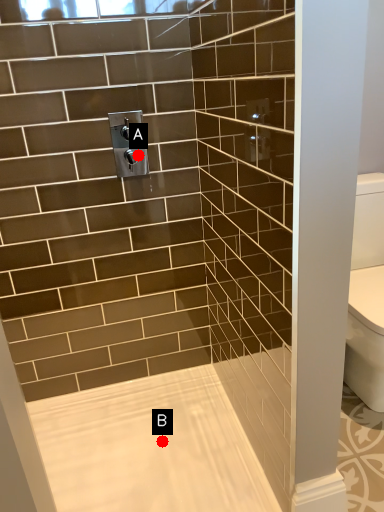
Question: Two points are circled on the image, labeled by A and B beside each circle. Among these points, which one is farthest from the camera?

Choices:
 (A) A is further
 (B) B is further

Answer: (B)